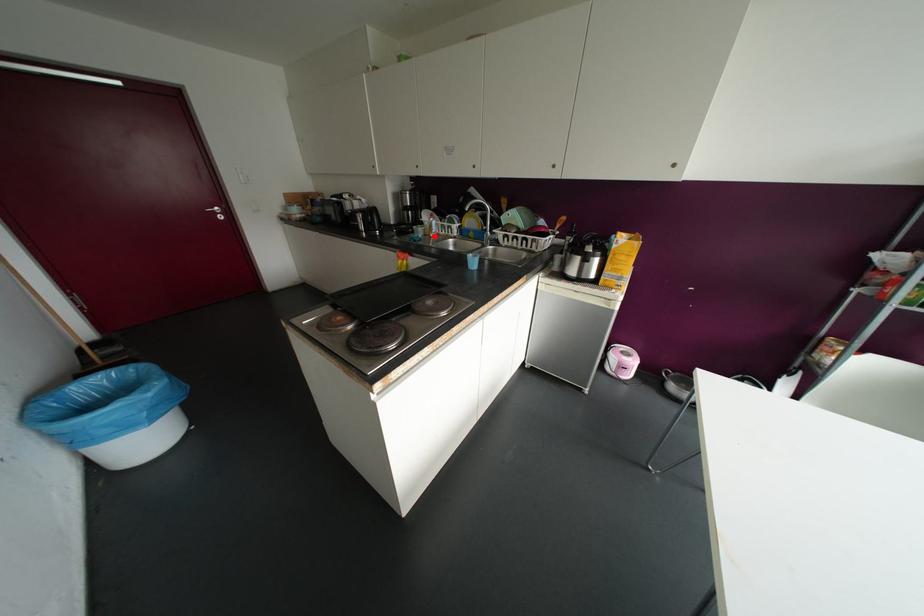
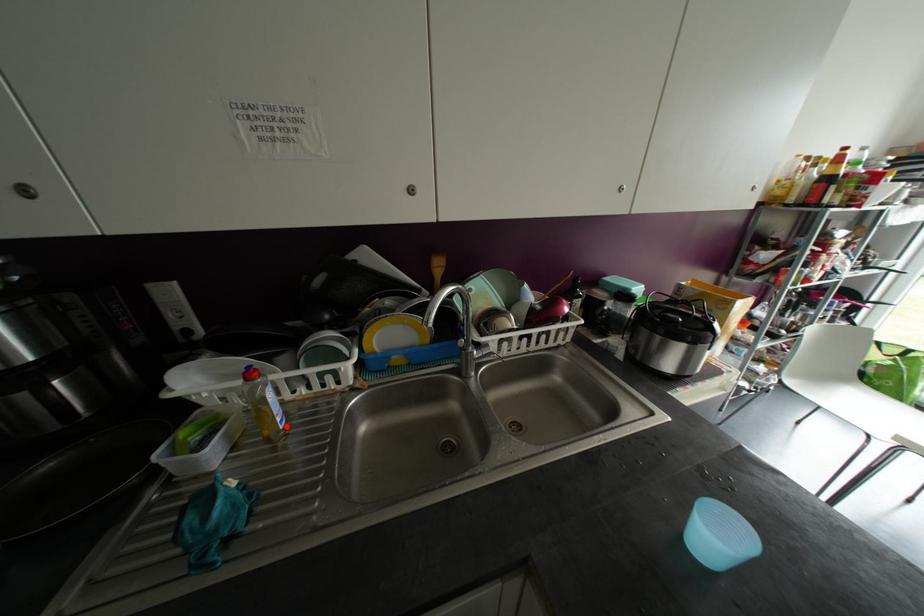
I am providing you with two images of the same scene from different viewpoints. A red point is marked on the first image and another point is marked on the second image. Are the points marked in image1 and image2 representing the same 3D position?

Yes